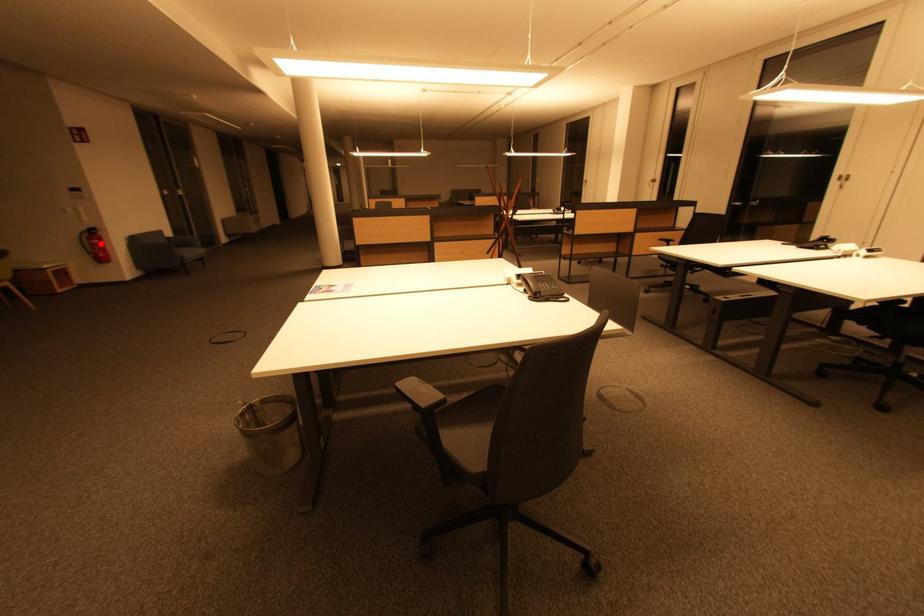
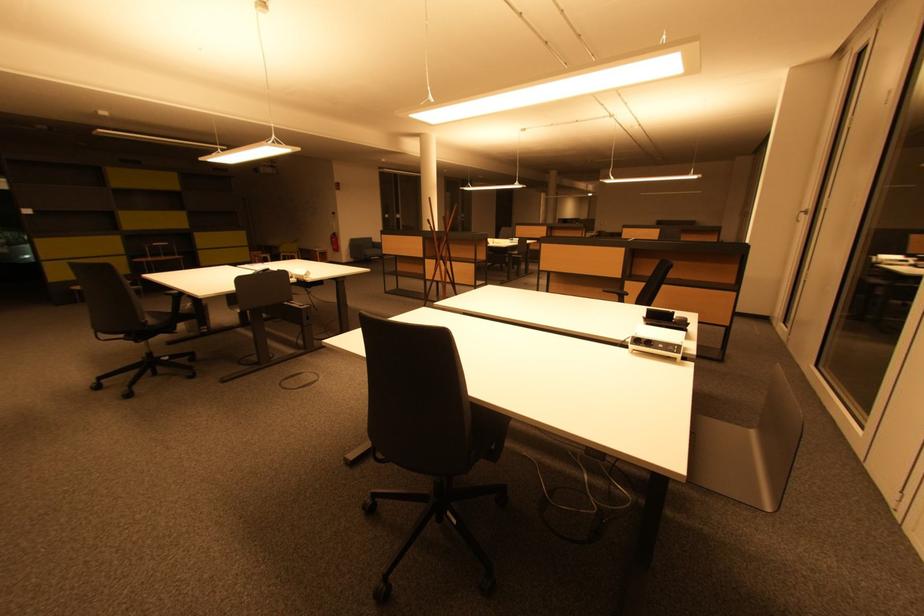
Question: I am providing you with two images of the same scene from different viewpoints. Given a red point in image1, look at the same physical point in image2. Is it:

Choices:
 (A) Closer to the viewpoint
 (B) Farther from the viewpoint

Answer: (A)